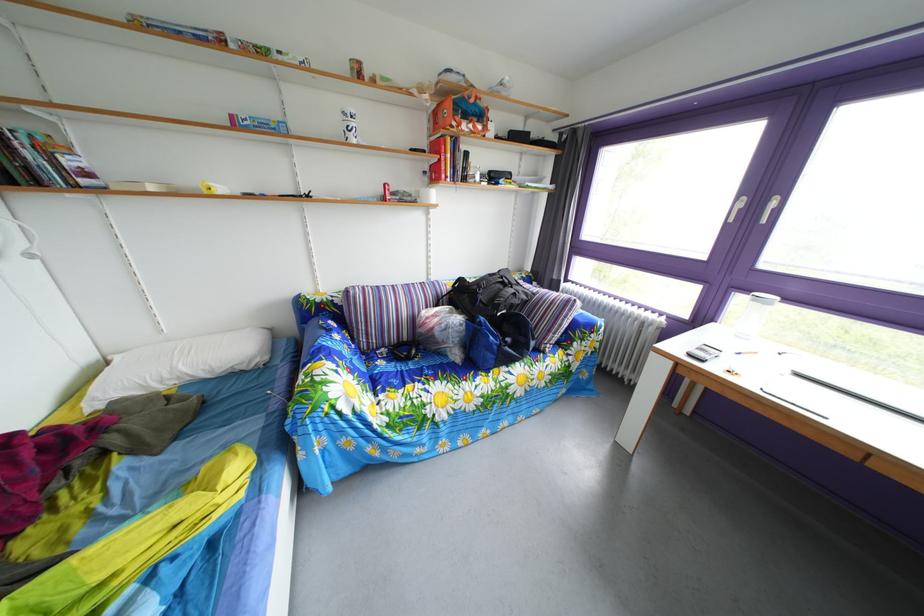
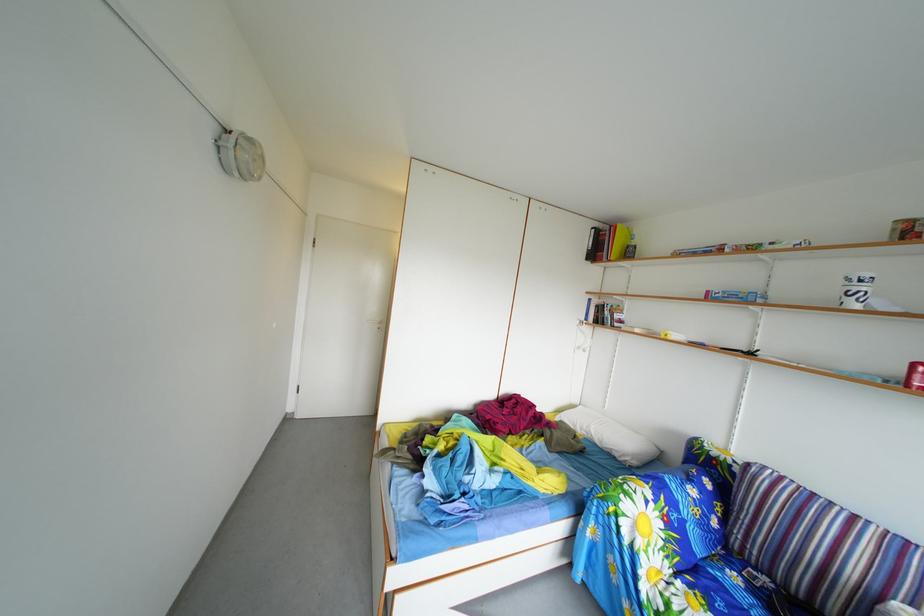
The point at (391, 371) is marked in the first image. Where is the corresponding point in the second image?

(746, 585)